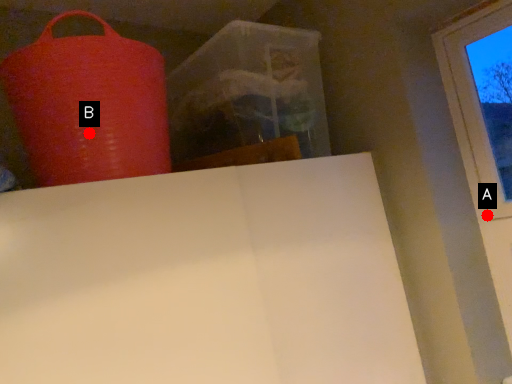
Question: Two points are circled on the image, labeled by A and B beside each circle. Which of the following is the farthest from the observer?

Choices:
 (A) A is further
 (B) B is further

Answer: (A)